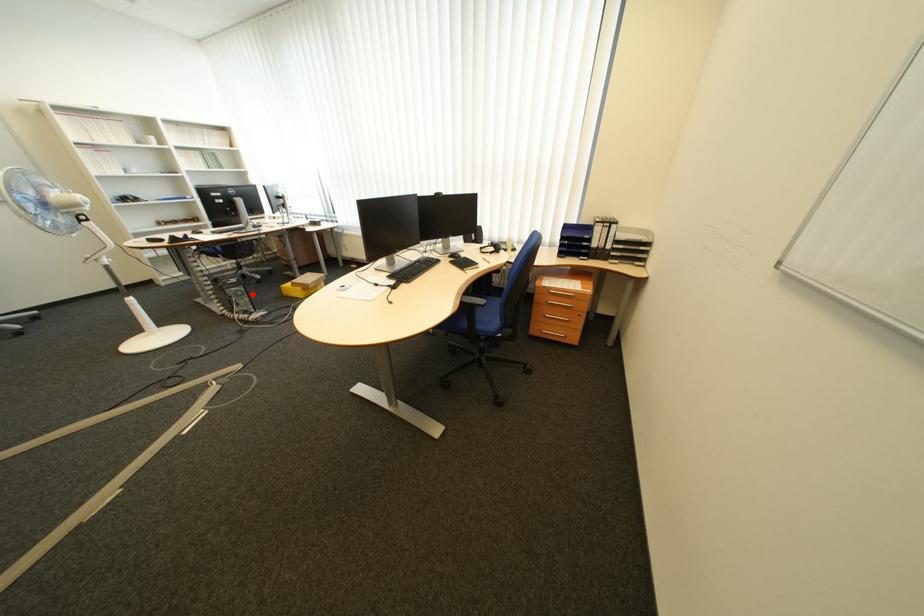
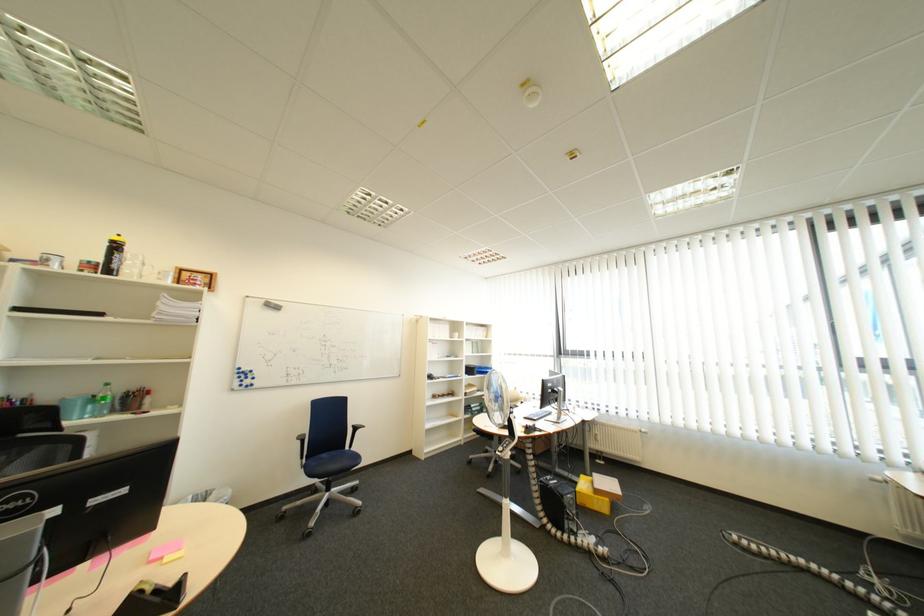
The point at the highlighted location is marked in the first image. Where is the corresponding point in the second image?

(585, 503)